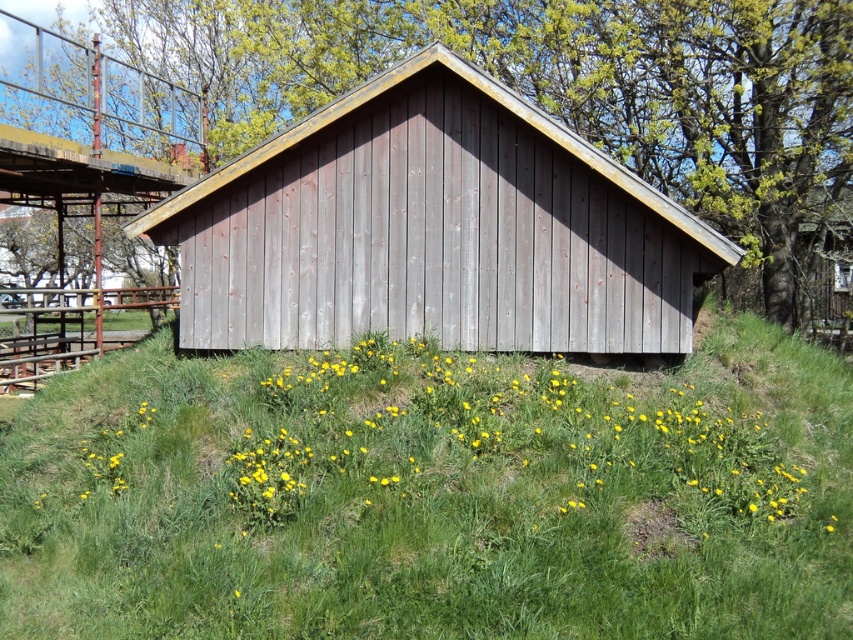
You are planning to place a small garden ornament that requires a space of 1 square meter. Based on the scene, which area between the green grassy at center and the weathered wood hut at center would be more suitable for placing the ornament?

The green grassy at center has a smaller size compared to the weathered wood hut at center, so the weathered wood hut at center would provide more space for placing the ornament since it is larger.